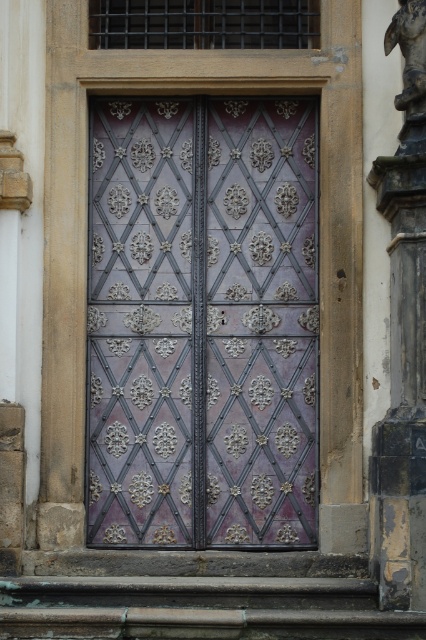
You are standing in front of an ornate door structure. You need to locate the purple metallic door at center. Where exactly is it positioned?

The purple metallic door at center is located at point (203, 323).

You are an architect examining the door and pillar. Which object would require more material to construct between the purple metallic door at center and the dark gray stone pillar at right?

The purple metallic door at center is larger in size than the dark gray stone pillar at right, so it would require more material to construct.